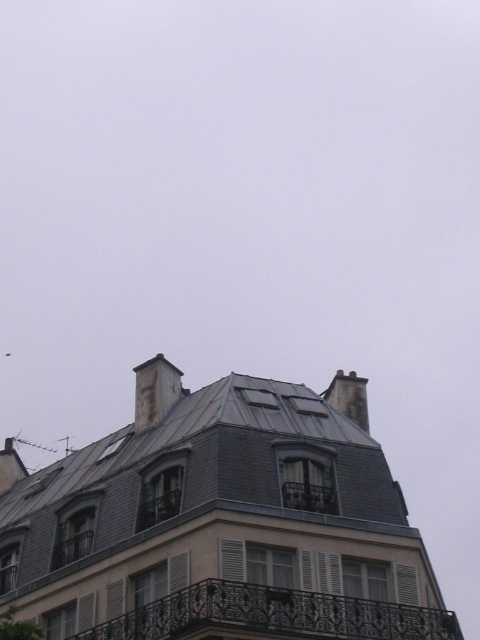
Question: Which object appears farthest from the camera in this image?

Choices:
 (A) dark gray stone chimney at upper right
 (B) smooth gray chimney at upper left
 (C) metallic balcony at center

Answer: (B)

Question: Which of the following is the closest to the observer?

Choices:
 (A) black wrought iron balcony at center
 (B) metallic balcony at center

Answer: (A)

Question: Which object is positioned farthest from the metallic balcony at center?

Choices:
 (A) smooth gray chimney at upper left
 (B) black wrought iron balcony at center
 (C) dark gray stone chimney at upper center

Answer: (A)

Question: Considering the relative positions of black wrought iron balcony at center and metallic balcony at center in the image provided, where is black wrought iron balcony at center located with respect to metallic balcony at center?

Choices:
 (A) above
 (B) below

Answer: (B)

Question: Where is dark gray stone chimney at upper right located in relation to smooth gray chimney at upper left in the image?

Choices:
 (A) left
 (B) right

Answer: (B)

Question: Considering the relative positions of black wrought iron balcony at center and dark gray stone chimney at upper right in the image provided, where is black wrought iron balcony at center located with respect to dark gray stone chimney at upper right?

Choices:
 (A) right
 (B) left

Answer: (B)